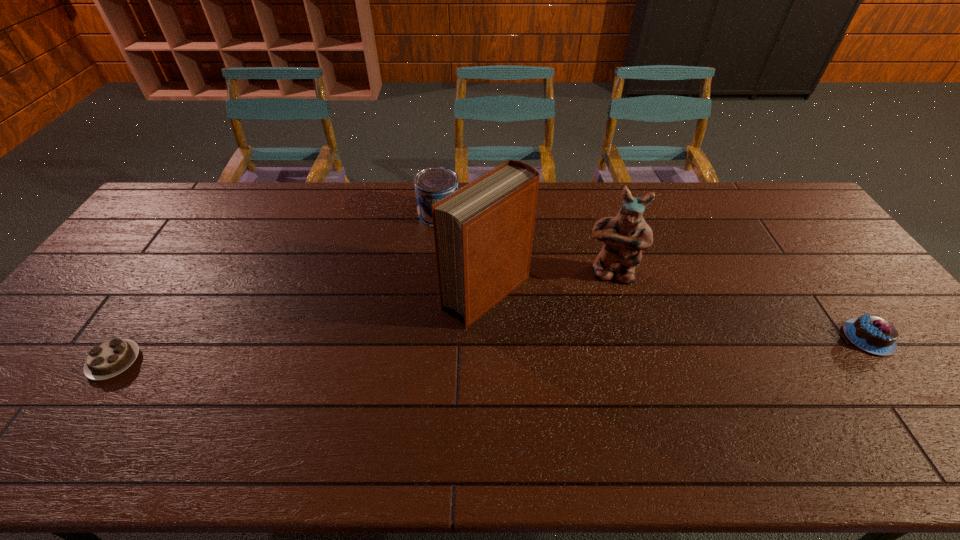
The height and width of the screenshot is (540, 960). I want to click on free location located on the left of the right chocolate cake, so click(x=730, y=338).

At what (x,y) coordinates should I click in order to perform the action: click on vacant region located 0.200m on the front label of the third tallest object. Please return your answer as a coordinate pair (x, y). The width and height of the screenshot is (960, 540). Looking at the image, I should click on (422, 268).

The height and width of the screenshot is (540, 960). In order to click on vacant area situated 0.150m on the front label of the third tallest object in this screenshot , I will do `click(426, 257)`.

The height and width of the screenshot is (540, 960). Find the location of `vacant space located 0.280m on the front label of the third tallest object`. vacant space located 0.280m on the front label of the third tallest object is located at coordinates (417, 288).

What are the coordinates of `vacant space situated on the front-facing side of the figurine` in the screenshot? It's located at 607,346.

At what (x,y) coordinates should I click in order to perform the action: click on free space located 0.160m on the front-facing side of the figurine. Please return your answer as a coordinate pair (x, y). This screenshot has height=540, width=960. Looking at the image, I should click on (608, 330).

Identify the location of vacant point located on the front-facing side of the figurine. (608, 330).

This screenshot has height=540, width=960. Find the location of `free space located on the open cover of the hardback book`. free space located on the open cover of the hardback book is located at coordinates (376, 380).

The height and width of the screenshot is (540, 960). Find the location of `free space located on the open cover of the hardback book`. free space located on the open cover of the hardback book is located at coordinates (372, 383).

Identify the location of vacant space located on the open cover of the hardback book. This screenshot has width=960, height=540. (383, 375).